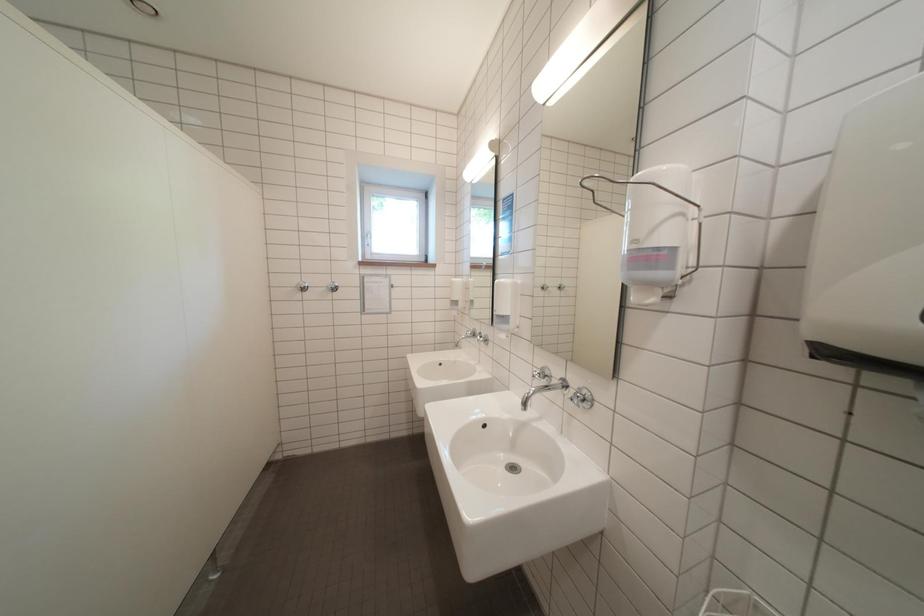
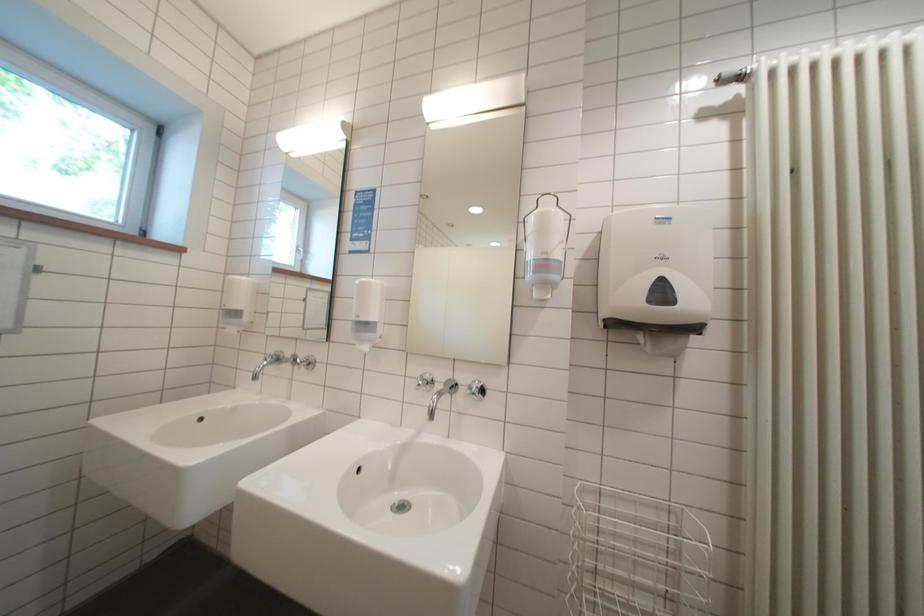
Question: How did the camera likely rotate?

Choices:
 (A) Left
 (B) Right
 (C) Up
 (D) Down

Answer: (B)